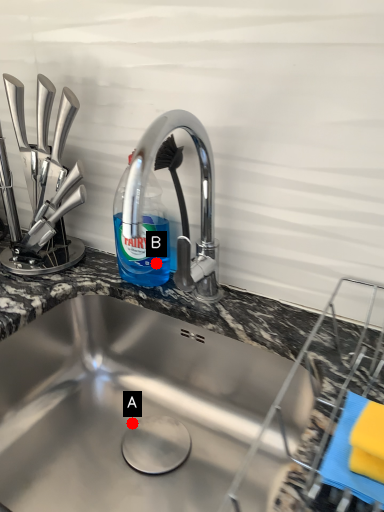
Question: Two points are circled on the image, labeled by A and B beside each circle. Which point is farther to the camera?

Choices:
 (A) A is further
 (B) B is further

Answer: (B)